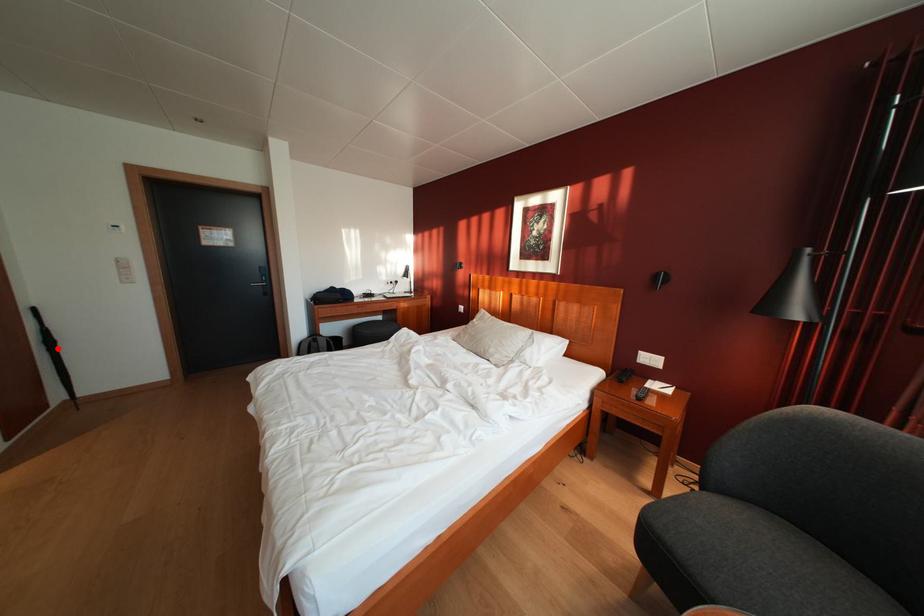
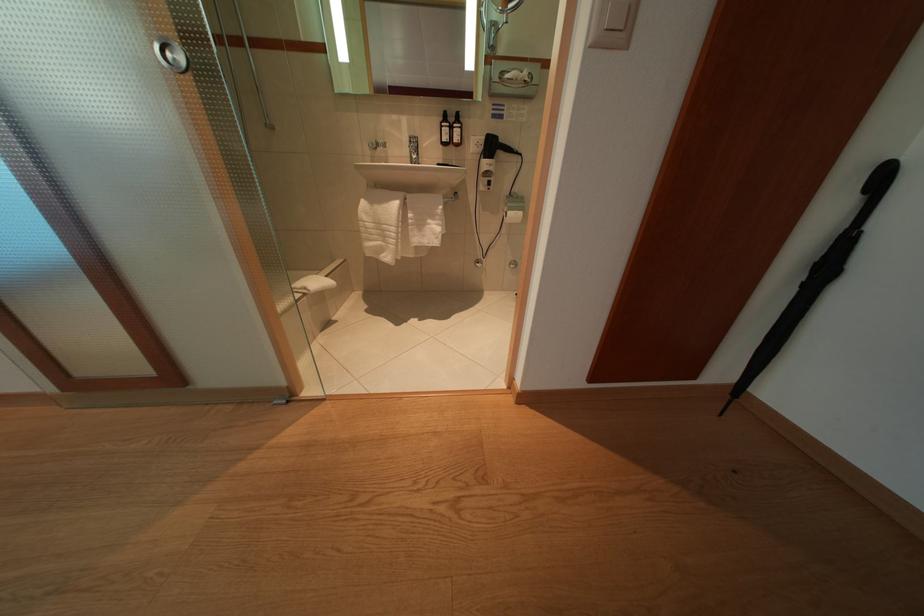
Question: A red point is marked in image1. In image2, is the corresponding 3D point closer to the camera or farther? Reply with the corresponding letter.

Choices:
 (A) The corresponding 3D point is closer.
 (B) The corresponding 3D point is farther.

Answer: (A)